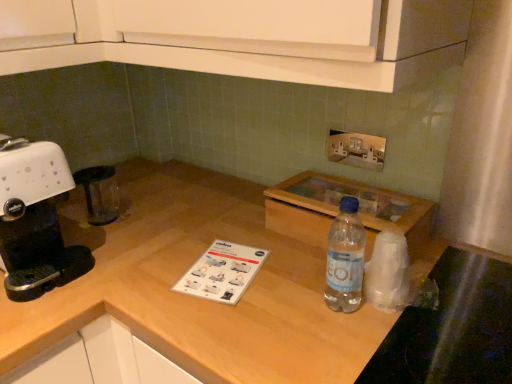
The image size is (512, 384). I want to click on vacant space in front of transparent plastic bag at right, so click(403, 337).